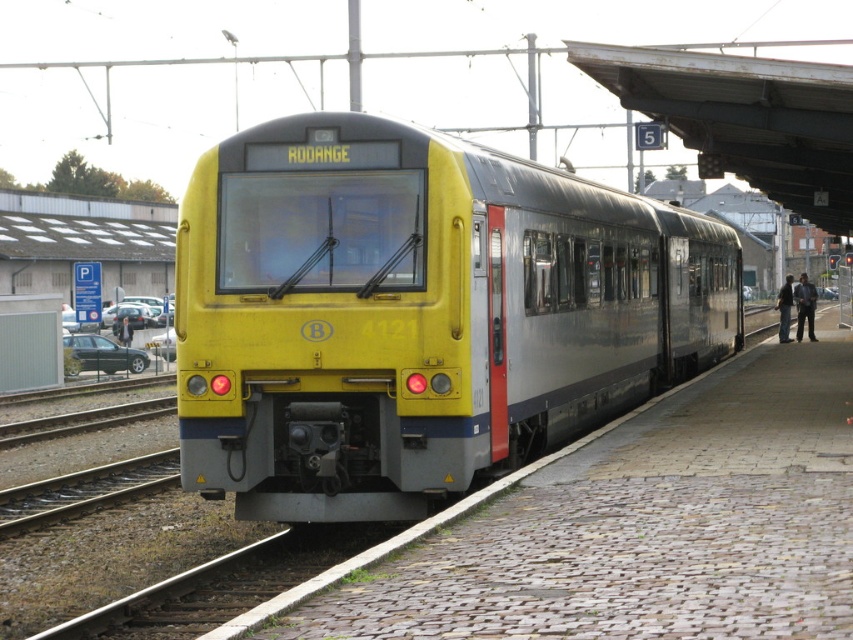
Is the position of yellow matte train at center less distant than that of cobblestone platform at center?

No, it is not.

Where is `yellow matte train at center`? The image size is (853, 640). yellow matte train at center is located at coordinates (418, 314).

Locate an element on the screen. yellow matte train at center is located at coordinates (418, 314).